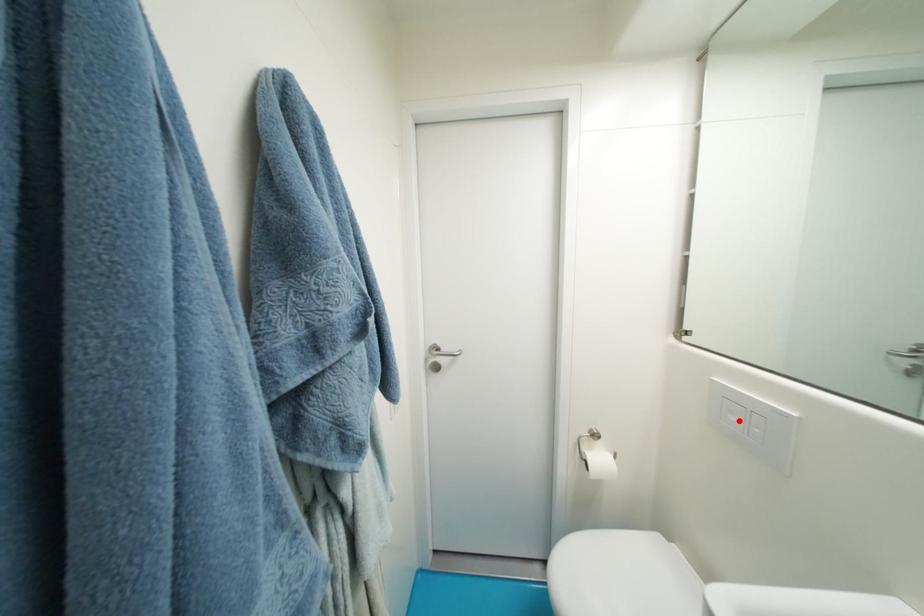
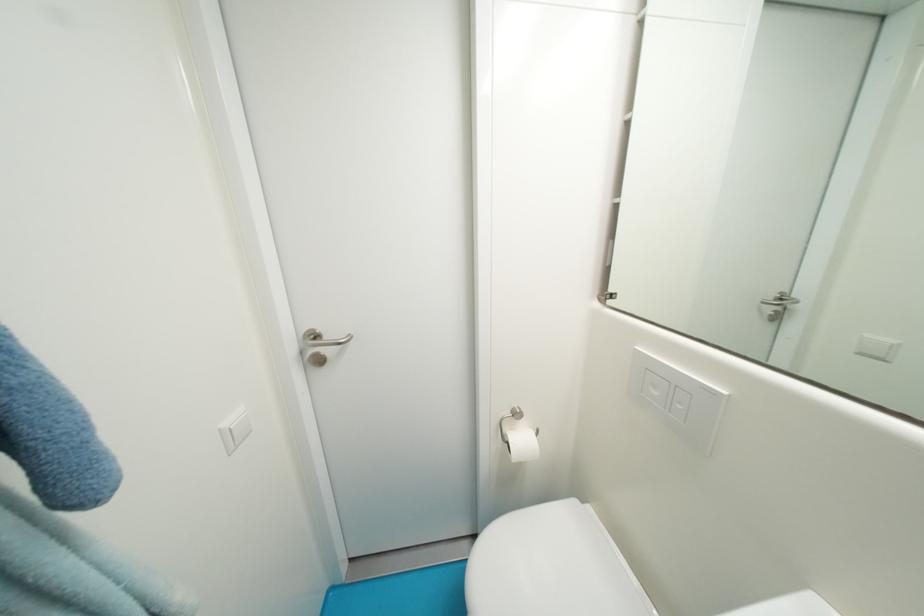
In the second image, find the point that corresponds to the highlighted location in the first image.

(662, 395)